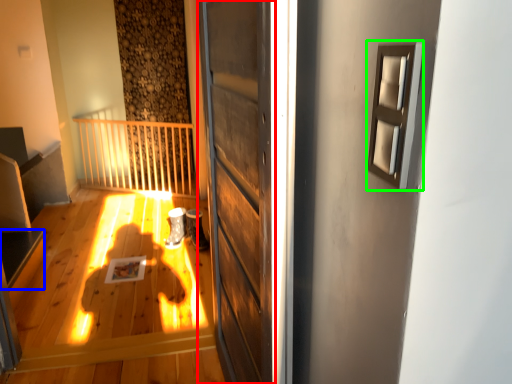
Question: Based on their relative distances, which object is farther from door (highlighted by a red box)? Choose from stairwell (highlighted by a blue box) and window (highlighted by a green box).

Choices:
 (A) stairwell
 (B) window

Answer: (A)